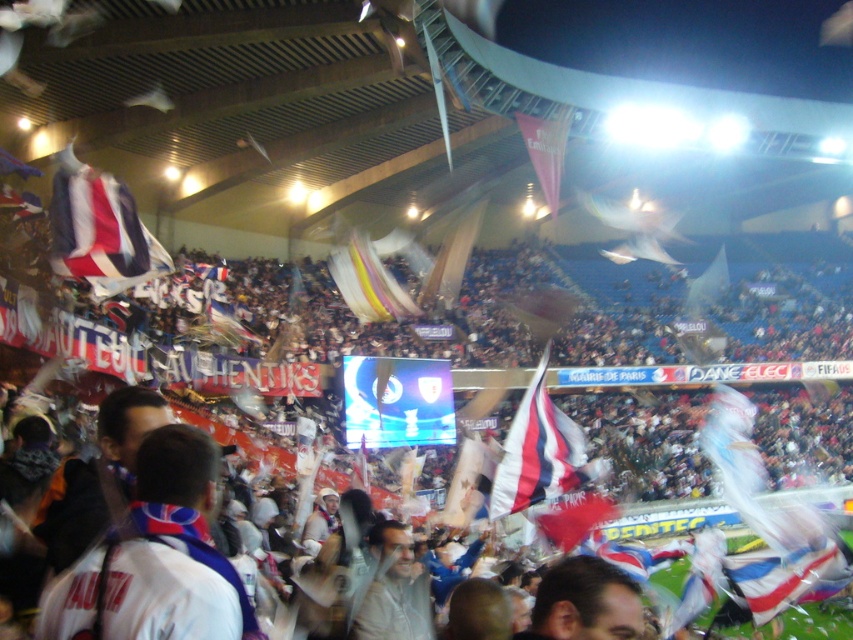
Can you confirm if white fabric head at center is smaller than matte pink flag at upper center?

Yes.

Is point (636, 584) positioned after point (553, 180)?

No.

At what (x,y) coordinates should I click in order to perform the action: click on white fabric head at center. Please return your answer as a coordinate pair (x, y). Looking at the image, I should click on (585, 602).

Can you confirm if white fabric flag at center is positioned to the left of translucent plastic flag at center?

No, white fabric flag at center is not to the left of translucent plastic flag at center.

You are a GUI agent. You are given a task and a screenshot of the screen. Output one action in this format:
    pyautogui.click(x=<x>, y=<y>)
    Task: Click on the white fabric flag at center
    
    Given the screenshot: What is the action you would take?
    pyautogui.click(x=537, y=452)

Can you confirm if white fabric head at center is positioned above translucent plastic flag at center?

→ Actually, white fabric head at center is below translucent plastic flag at center.

Does point (612, 564) come farther from viewer compared to point (376, 259)?

No, (612, 564) is in front of (376, 259).

This screenshot has height=640, width=853. Identify the location of white fabric head at center. (585, 602).